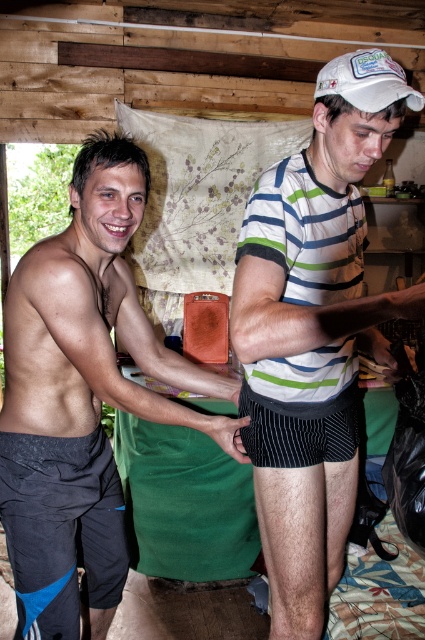
Question: From the image, what is the correct spatial relationship of black synthetic shorts at lower left in relation to black matte hand at center?

Choices:
 (A) above
 (B) below

Answer: (B)

Question: Which point is farther from the camera taking this photo?

Choices:
 (A) (31, 374)
 (B) (70, 554)

Answer: (B)

Question: Among these points, which one is farthest from the camera?

Choices:
 (A) (53, 592)
 (B) (325, 532)
 (C) (64, 480)
 (D) (240, 436)

Answer: (D)

Question: Which of the following is the closest to the observer?

Choices:
 (A) (246, 422)
 (B) (125, 570)
 (C) (354, 81)
 (D) (30, 525)

Answer: (C)

Question: Is black matte shorts at left above black synthetic shorts at lower left?

Choices:
 (A) no
 (B) yes

Answer: (B)

Question: Is white fabric baseball cap at upper right bigger than black matte hand at center?

Choices:
 (A) yes
 (B) no

Answer: (A)